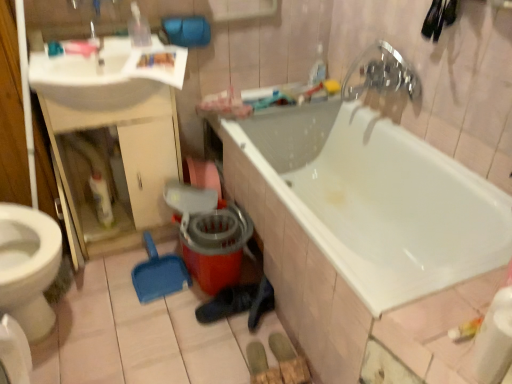
Locate an element on the screen. The image size is (512, 384). chrome metallic faucet at upper right is located at coordinates (380, 73).

What is the approximate width of chrome metallic faucet at upper right?

chrome metallic faucet at upper right is 6.21 inches wide.

What do you see at coordinates (101, 198) in the screenshot?
I see `white glossy bottle at left` at bounding box center [101, 198].

Image resolution: width=512 pixels, height=384 pixels. I want to click on white glossy sink at upper left, so click(x=105, y=77).

The height and width of the screenshot is (384, 512). I want to click on white glossy bathtub at center, so click(376, 189).

Considering the sizes of objects white glossy sink at upper left and chrome metallic faucet at upper right in the image provided, who is taller, white glossy sink at upper left or chrome metallic faucet at upper right?

chrome metallic faucet at upper right is taller.

Could you tell me if white glossy sink at upper left is turned towards chrome metallic faucet at upper right?

No, white glossy sink at upper left does not turn towards chrome metallic faucet at upper right.

Between white glossy sink at upper left and chrome metallic faucet at upper right, which one has smaller size?

chrome metallic faucet at upper right is smaller.

Can you tell me how much white glossy sink at upper left and chrome metallic faucet at upper right differ in facing direction?

86.5 degrees.

Can you confirm if white glossy sink at upper left is taller than white glossy bottle at left?

Incorrect, the height of white glossy sink at upper left is not larger of that of white glossy bottle at left.

From the image's perspective, between white glossy sink at upper left and white glossy bottle at left, which one is located above?

white glossy sink at upper left is shown above in the image.

From a real-world perspective, is white glossy sink at upper left below white glossy bottle at left?

Actually, white glossy sink at upper left is physically above white glossy bottle at left in the real world.

Consider the image. Between white glossy bottle at left and white glossy sink at upper left, which one has smaller width?

white glossy bottle at left.

Is white glossy bottle at left aimed at white glossy sink at upper left?

No, white glossy bottle at left is not turned towards white glossy sink at upper left.

Is white glossy bottle at left positioned far away from white glossy sink at upper left?

white glossy bottle at left is near white glossy sink at upper left, not far away.

Between chrome metallic faucet at upper right and white glossy bathtub at center, which one appears on the left side from the viewer's perspective?

Positioned to the left is white glossy bathtub at center.

From a real-world perspective, which is physically below, chrome metallic faucet at upper right or white glossy bathtub at center?

From a 3D spatial view, white glossy bathtub at center is below.

Does chrome metallic faucet at upper right turn towards white glossy bathtub at center?

No, chrome metallic faucet at upper right is not aimed at white glossy bathtub at center.

This screenshot has height=384, width=512. What are the coordinates of `bathtub located on the left of chrome metallic faucet at upper right` in the screenshot? It's located at (376, 189).

Measure the distance from white glossy bottle at left to white glossy bathtub at center.

3.42 feet.

Consider the image. Is white glossy bottle at left situated inside white glossy bathtub at center or outside?

The correct answer is: outside.

Can you confirm if white glossy bottle at left is positioned to the left of white glossy bathtub at center?

Correct, you'll find white glossy bottle at left to the left of white glossy bathtub at center.

From the picture: From a real-world perspective, is white glossy bottle at left physically located above or below white glossy bathtub at center?

From a real-world perspective, white glossy bottle at left is physically below white glossy bathtub at center.

Considering the relative sizes of white glossy sink at upper left and white glossy bathtub at center in the image provided, is white glossy sink at upper left thinner than white glossy bathtub at center?

Yes.

Which is correct: white glossy sink at upper left is inside white glossy bathtub at center, or outside of it?

white glossy sink at upper left cannot be found inside white glossy bathtub at center.

Considering the sizes of objects white glossy sink at upper left and white glossy bathtub at center in the image provided, who is taller, white glossy sink at upper left or white glossy bathtub at center?

With more height is white glossy bathtub at center.

From the image's perspective, which one is positioned higher, white glossy sink at upper left or white glossy bathtub at center?

white glossy sink at upper left appears higher in the image.

Is the position of white glossy bathtub at center less distant than that of white glossy bottle at left?

Yes, white glossy bathtub at center is in front of white glossy bottle at left.

Could you tell me if white glossy bathtub at center is turned towards white glossy bottle at left?

Yes.

Does white glossy bathtub at center touch white glossy bottle at left?

No.

Find the location of `tap lying on the right of white glossy sink at upper left`. tap lying on the right of white glossy sink at upper left is located at coordinates (380, 73).

I want to click on sink above the white glossy bottle at left (from a real-world perspective), so click(105, 77).

When comparing their distances from white glossy bottle at left, does chrome metallic faucet at upper right or white glossy bathtub at center seem further?

chrome metallic faucet at upper right is positioned further to the anchor white glossy bottle at left.

From the image, which object appears to be nearer to chrome metallic faucet at upper right, white glossy sink at upper left or white glossy bottle at left?

white glossy sink at upper left is closer to chrome metallic faucet at upper right.

When comparing their distances from chrome metallic faucet at upper right, does white glossy bottle at left or white glossy sink at upper left seem closer?

The object closer to chrome metallic faucet at upper right is white glossy sink at upper left.

Considering their positions, is white glossy sink at upper left positioned closer to white glossy bathtub at center than white glossy bottle at left?

white glossy sink at upper left.

Looking at the image, which one is located closer to white glossy bottle at left, white glossy bathtub at center or white glossy sink at upper left?

Among the two, white glossy sink at upper left is located nearer to white glossy bottle at left.

Based on their spatial positions, is white glossy bathtub at center or chrome metallic faucet at upper right further from white glossy sink at upper left?

Among the two, chrome metallic faucet at upper right is located further to white glossy sink at upper left.

Based on their spatial positions, is white glossy bottle at left or chrome metallic faucet at upper right further from white glossy bathtub at center?

white glossy bottle at left is further to white glossy bathtub at center.

Which object lies further to the anchor point white glossy bottle at left, white glossy sink at upper left or chrome metallic faucet at upper right?

The object further to white glossy bottle at left is chrome metallic faucet at upper right.

This screenshot has width=512, height=384. I want to click on bathtub between white glossy sink at upper left and chrome metallic faucet at upper right, so click(x=376, y=189).

Locate an element on the screen. The image size is (512, 384). bathtub located between white glossy bottle at left and chrome metallic faucet at upper right in the left-right direction is located at coordinates (376, 189).

Identify the location of sink situated between white glossy bottle at left and chrome metallic faucet at upper right from left to right. (105, 77).

Image resolution: width=512 pixels, height=384 pixels. I want to click on sink between white glossy bottle at left and white glossy bathtub at center, so click(105, 77).